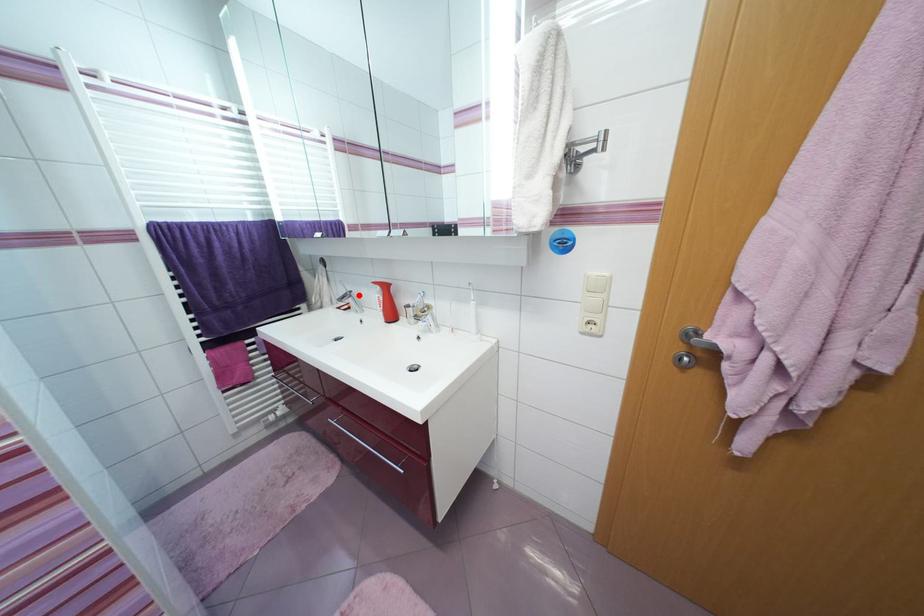
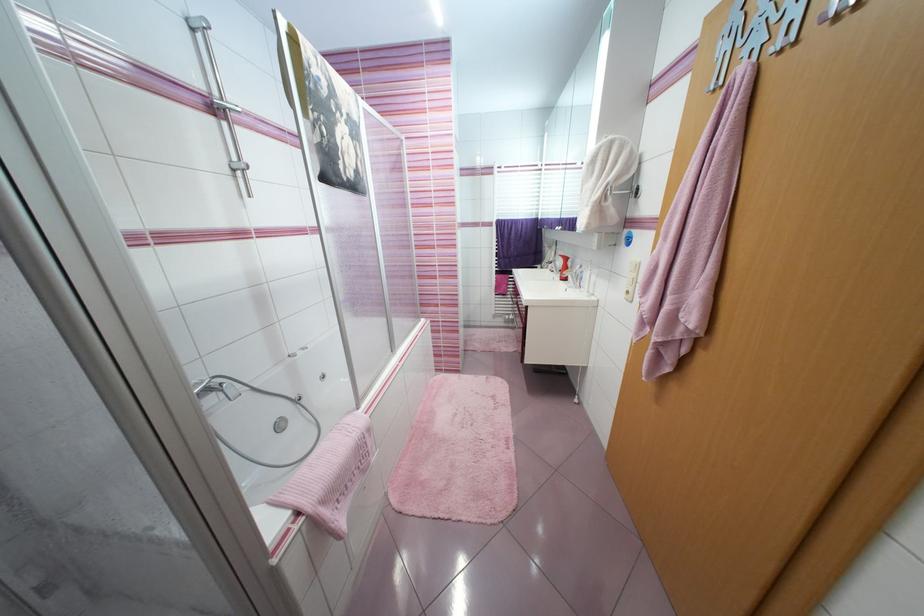
Question: I am providing you with two images of the same scene from different viewpoints. A red point is marked on the first image. Can you still see the location of the red point in image 2?

Choices:
 (A) Yes
 (B) No

Answer: (A)